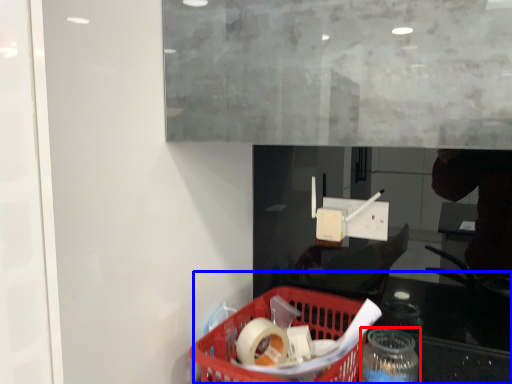
Question: Among these objects, which one is nearest to the camera, bottle (highlighted by a red box) or table (highlighted by a blue box)?

Choices:
 (A) bottle
 (B) table

Answer: (B)